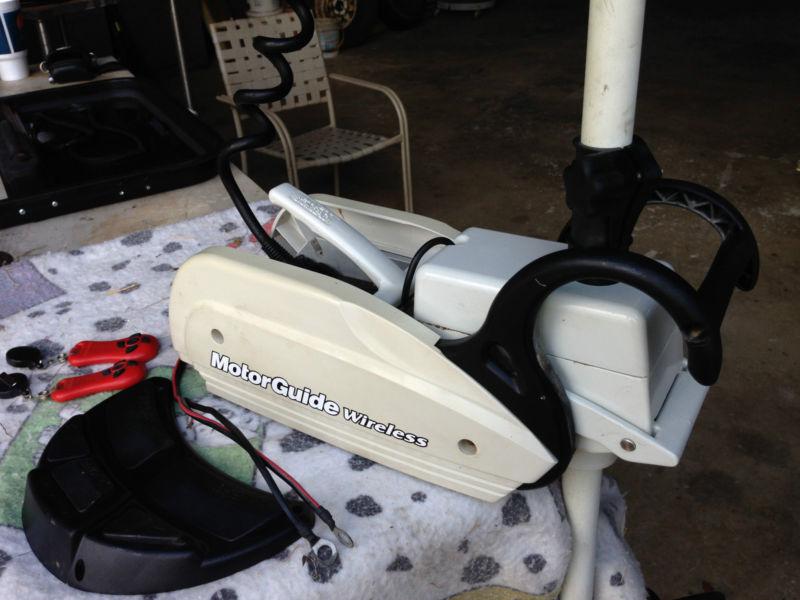
Identify the location of towel. (388, 510).